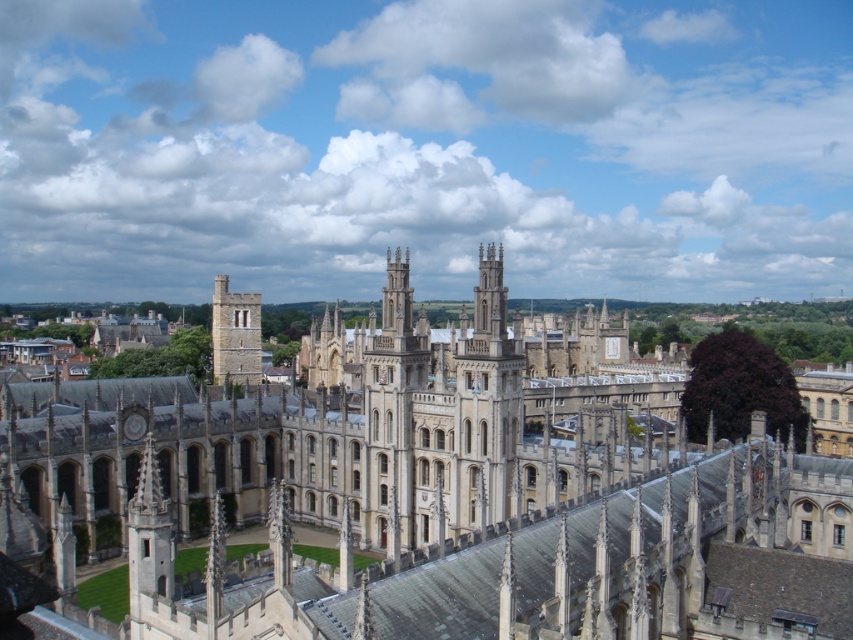
Is point (558, 392) farther from viewer compared to point (216, 349)?

That is False.

Between point (836, 467) and point (247, 371), which one is positioned behind?

The point (247, 371) is more distant.

This screenshot has height=640, width=853. Identify the location of beige stone cathedral at center. (437, 499).